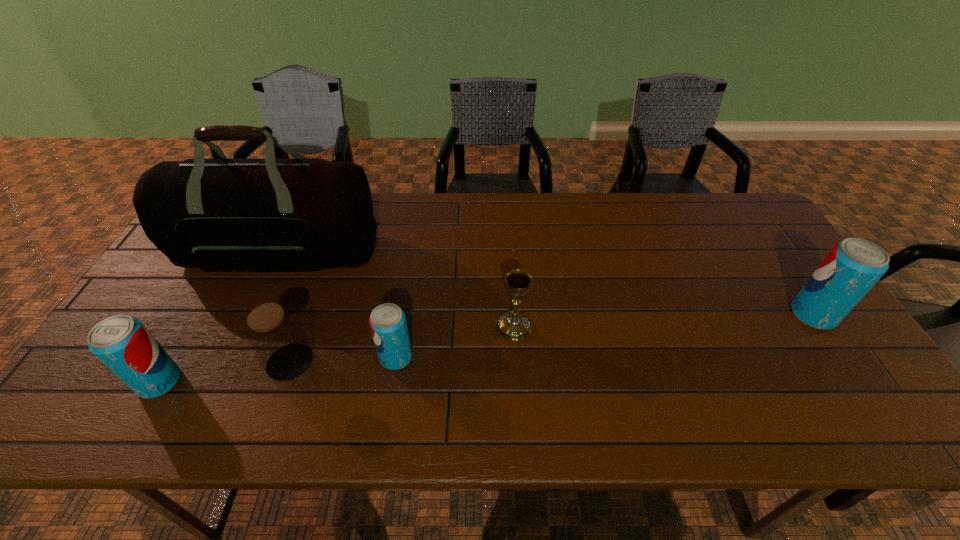
The image size is (960, 540). Identify the location of object positioned at the far left corner. (305, 214).

Where is `object that is at the near left corner`? The image size is (960, 540). object that is at the near left corner is located at coordinates (122, 343).

Where is `vacant space at the far edge of the desktop`? This screenshot has width=960, height=540. vacant space at the far edge of the desktop is located at coordinates (595, 198).

Locate an element on the screen. Image resolution: width=960 pixels, height=540 pixels. free spot at the near edge of the desktop is located at coordinates (176, 361).

You are a GUI agent. You are given a task and a screenshot of the screen. Output one action in this format:
    pyautogui.click(x=<x>, y=<y>)
    Task: Click on the vacant point at the right edge
    This screenshot has height=540, width=960.
    Given the screenshot: What is the action you would take?
    pyautogui.click(x=734, y=266)

Where is `vacant space at the far right corner`? vacant space at the far right corner is located at coordinates (749, 227).

Identify the location of vacant area at the near right corner. (817, 367).

At what (x,y) coordinates should I click in order to perform the action: click on vacant space that's between the shortest soda can and the jar. Please return your answer as a coordinate pair (x, y). Image resolution: width=960 pixels, height=540 pixels. Looking at the image, I should click on (343, 360).

This screenshot has height=540, width=960. What are the coordinates of `empty location between the fourth object from left to right and the farthest soda can` in the screenshot? It's located at (605, 336).

What are the coordinates of `free space between the second object from right to left and the farthest soda can` in the screenshot? It's located at (663, 320).